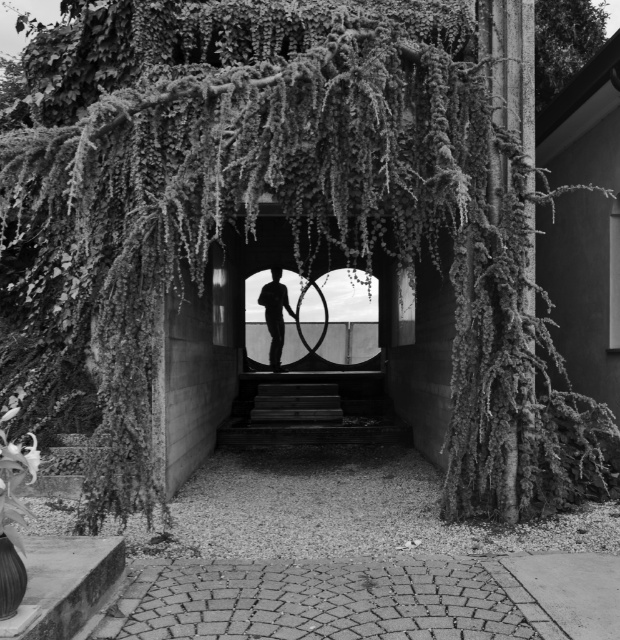
You are standing in front of the structure with the hanging vines. You see a smooth glass door at center and smooth wooden stairs at center. Which object is nearer to you?

The smooth glass door at center is closer to the viewer than the smooth wooden stairs at center, so the smooth glass door at center is nearer to you.